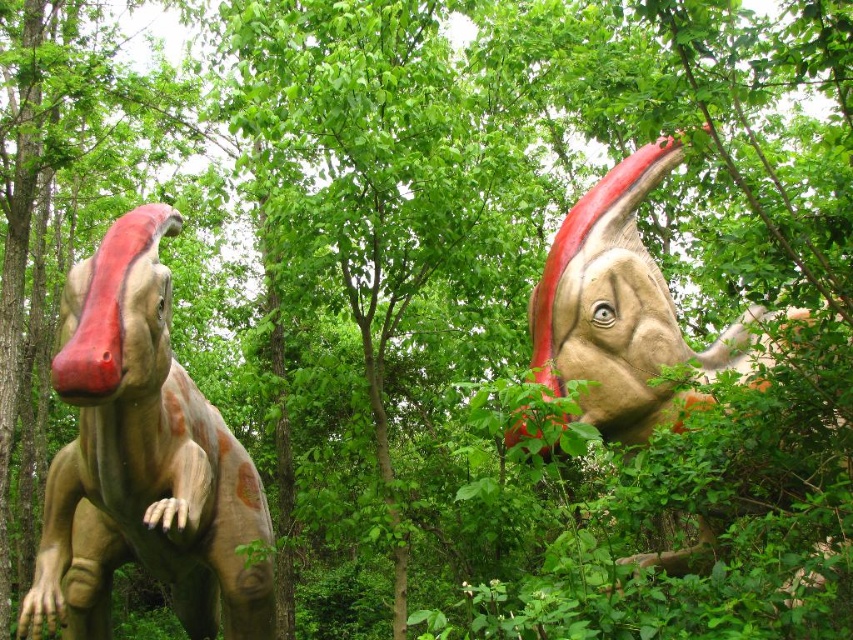
Is matte brown dinosaur at left smaller than matte orange dinosaur at upper right?

Yes, matte brown dinosaur at left is smaller than matte orange dinosaur at upper right.

Between matte brown dinosaur at left and matte orange dinosaur at upper right, which one has more height?

matte orange dinosaur at upper right

What do you see at coordinates (143, 460) in the screenshot? I see `matte brown dinosaur at left` at bounding box center [143, 460].

You are a GUI agent. You are given a task and a screenshot of the screen. Output one action in this format:
    pyautogui.click(x=<x>, y=<y>)
    Task: Click on the matte brown dinosaur at left
    The height and width of the screenshot is (640, 853).
    Given the screenshot: What is the action you would take?
    pyautogui.click(x=143, y=460)